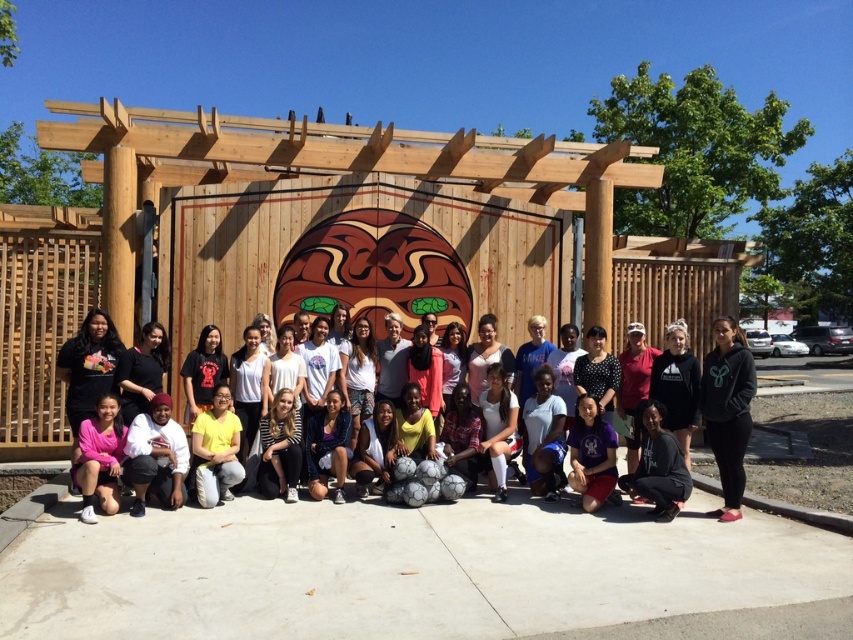
You are a GUI agent. You are given a task and a screenshot of the screen. Output one action in this format:
    pyautogui.click(x=<x>, y=<y>)
    Task: Click on the matte black hoodie at center
    
    Given the screenshot: What is the action you would take?
    pyautogui.click(x=675, y=396)

Which is in front, point (695, 387) or point (703, 401)?

Point (703, 401) is in front.

Does point (740, 365) come closer to viewer compared to point (712, 388)?

Yes, point (740, 365) is closer to viewer.

This screenshot has width=853, height=640. Identify the location of matte black hoodie at center. (675, 396).

Does matte black hoodie at center have a greater height compared to yellow matte shirt at center?

Yes.

Is point (689, 464) behind point (206, 417)?

No, (689, 464) is in front of (206, 417).

Measure the distance between matte black hoodie at center and camera.

matte black hoodie at center and camera are 6.08 meters apart.

You are a GUI agent. You are given a task and a screenshot of the screen. Output one action in this format:
    pyautogui.click(x=<x>, y=<y>)
    Task: Click on the matte black hoodie at center
    
    Given the screenshot: What is the action you would take?
    pyautogui.click(x=675, y=396)

Is white matte shirt at center bigger than yellow matte shirt at center?

Incorrect, white matte shirt at center is not larger than yellow matte shirt at center.

Does white matte shirt at center have a smaller size compared to yellow matte shirt at center?

Yes.

Is point (135, 490) farther from viewer compared to point (213, 404)?

No, it is in front of (213, 404).

I want to click on white matte shirt at center, so click(155, 456).